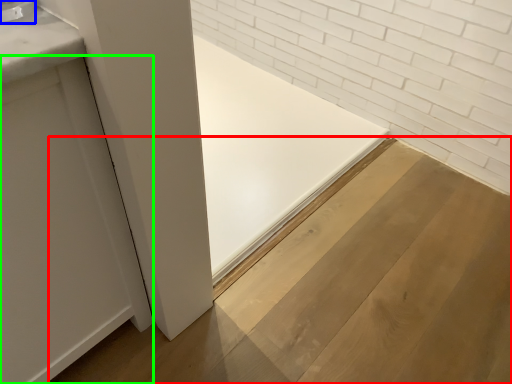
Question: Based on their relative distances, which object is nearer to plywood (highlighted by a red box)? Choose from faucet (highlighted by a blue box) and door (highlighted by a green box).

Choices:
 (A) faucet
 (B) door

Answer: (B)